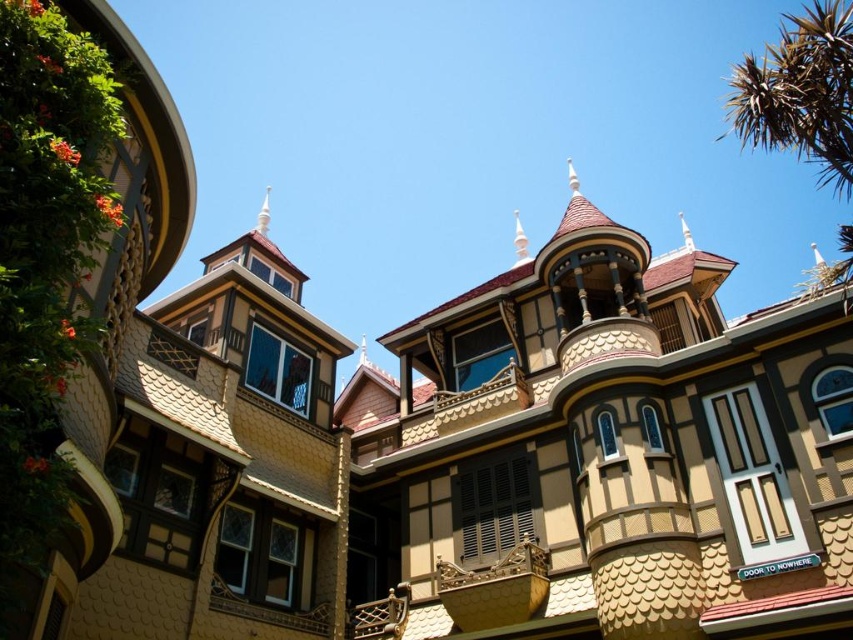
Who is more forward, [624,540] or [729,104]?

Point [624,540] is in front.

This screenshot has width=853, height=640. Find the location of `beige scalloped siding at center`. beige scalloped siding at center is located at coordinates (604, 452).

Is point (426, 632) positioned before point (827, 106)?

No, it is behind (827, 106).

This screenshot has width=853, height=640. Identify the location of beige scalloped siding at center. (604, 452).